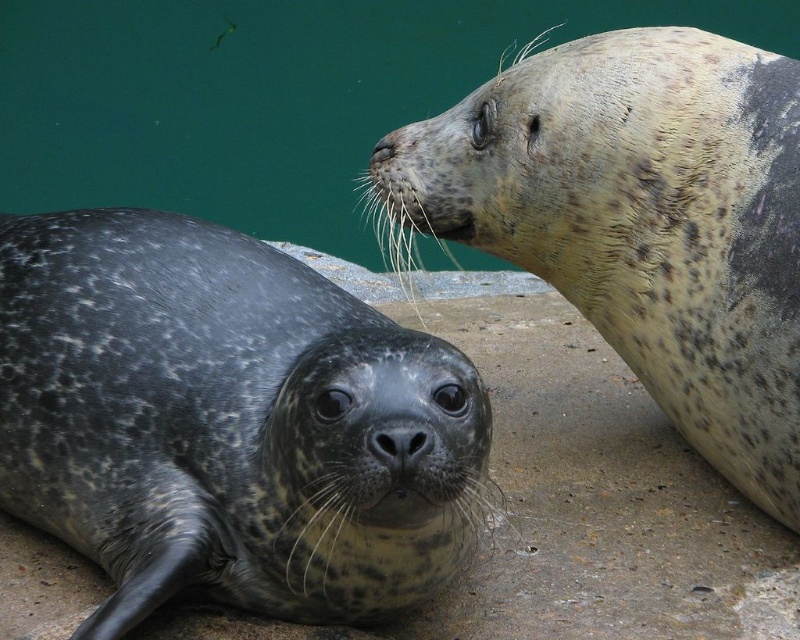
Question: Among these objects, which one is nearest to the camera?

Choices:
 (A) gray matte nose at upper center
 (B) speckled fur seal at upper right
 (C) spotted fur seal at lower left

Answer: (C)

Question: Among these objects, which one is farthest from the camera?

Choices:
 (A) speckled fur seal at upper right
 (B) gray matte nose at upper center
 (C) spotted fur seal at lower left

Answer: (B)

Question: Considering the real-world distances, which object is closest to the speckled fur seal at upper right?

Choices:
 (A) spotted fur seal at lower left
 (B) black matte nose at center
 (C) matte gray seal at upper center
 (D) gray matte nose at upper center

Answer: (D)

Question: Can you confirm if spotted fur seal at lower left is positioned to the left of gray matte nose at upper center?

Choices:
 (A) yes
 (B) no

Answer: (A)

Question: Is speckled fur seal at upper right to the right of black matte nose at center from the viewer's perspective?

Choices:
 (A) yes
 (B) no

Answer: (A)

Question: Can you confirm if black matte nose at center is wider than gray matte nose at upper center?

Choices:
 (A) no
 (B) yes

Answer: (B)